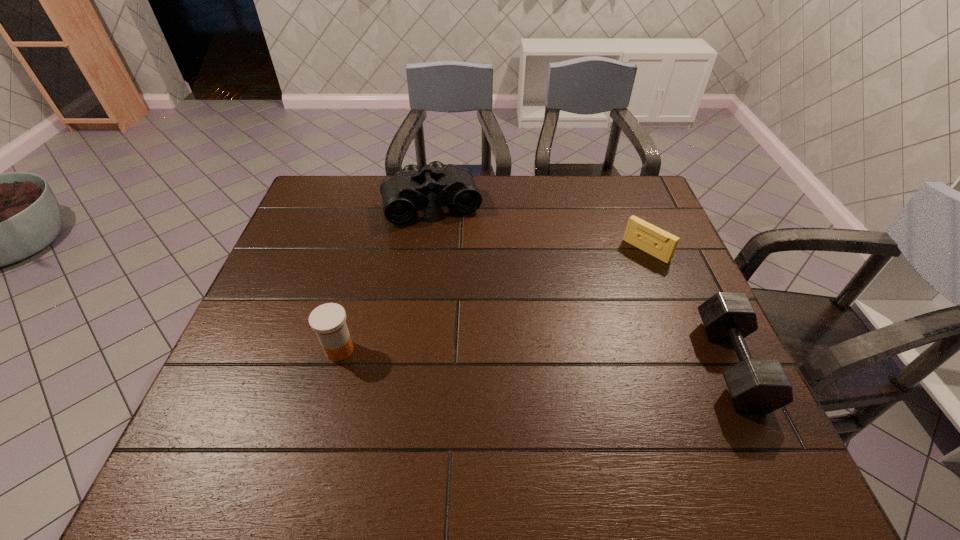
At what (x,y) coordinates should I click in order to perform the action: click on vacant space that satisfies the following two spatial constraints: 1. on the label of the dumbbell; 2. on the right side of the medicine. Please return your answer as a coordinate pair (x, y). Looking at the image, I should click on (335, 364).